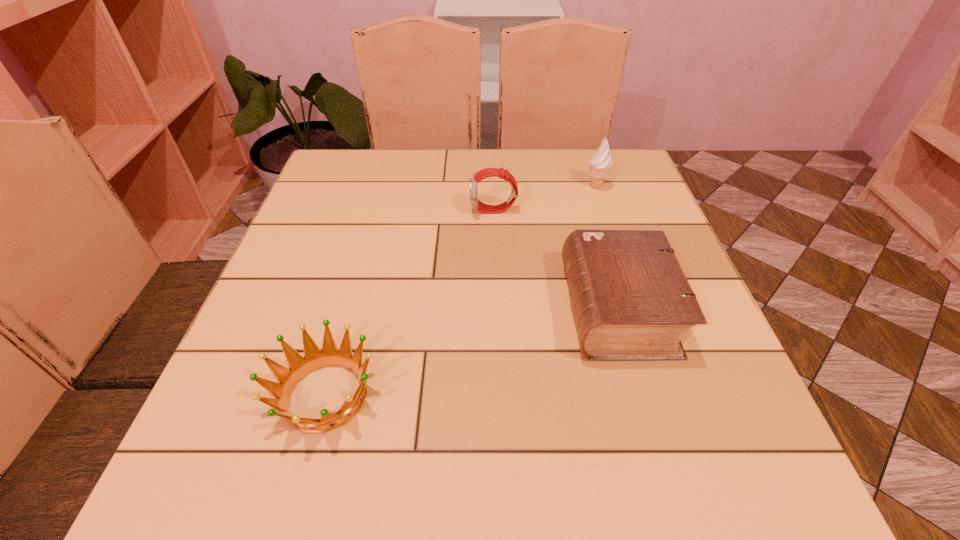
Locate an element on the screen. The height and width of the screenshot is (540, 960). vacant region between the third nearest object and the leftmost object is located at coordinates (410, 303).

At what (x,y) coordinates should I click in order to perform the action: click on free space that is in between the farthest object and the shortest object. Please return your answer as a coordinate pair (x, y). This screenshot has width=960, height=540. Looking at the image, I should click on (461, 291).

Find the location of a particular element. vacant area that lies between the shortest object and the Bible is located at coordinates (471, 352).

At what (x,y) coordinates should I click in order to perform the action: click on unoccupied area between the farthest object and the watch. Please return your answer as a coordinate pair (x, y). Looking at the image, I should click on (544, 199).

Where is `free area in between the leftmost object and the Bible`? This screenshot has width=960, height=540. free area in between the leftmost object and the Bible is located at coordinates (471, 352).

Locate an element on the screen. The height and width of the screenshot is (540, 960). vacant area that lies between the Bible and the leftmost object is located at coordinates (471, 352).

Locate an element on the screen. The image size is (960, 540). vacant area between the farthest object and the watch is located at coordinates coord(544,199).

Identify the location of free space between the crown and the watch. (410, 303).

Find the location of `unoccupied position between the third object from right to left and the leftmost object`. unoccupied position between the third object from right to left and the leftmost object is located at coordinates (410, 303).

Identify the location of object identified as the third closest to the Bible. This screenshot has width=960, height=540. (299, 367).